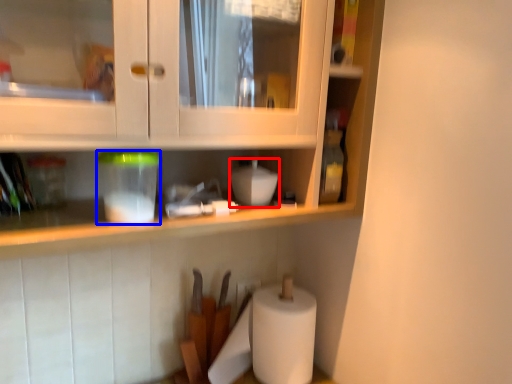
Question: Which object is further to the camera taking this photo, appliance (highlighted by a red box) or appliance (highlighted by a blue box)?

Choices:
 (A) appliance
 (B) appliance

Answer: (A)